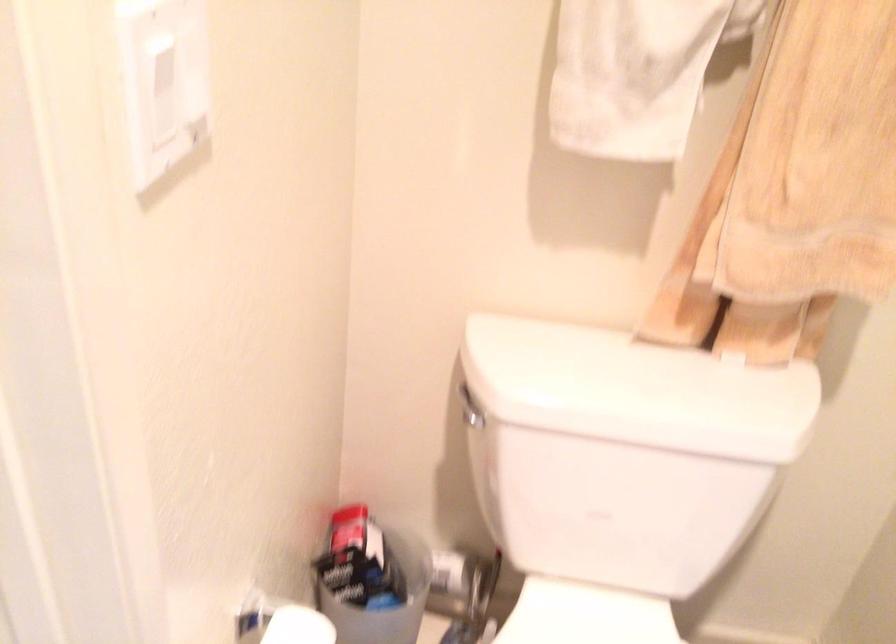
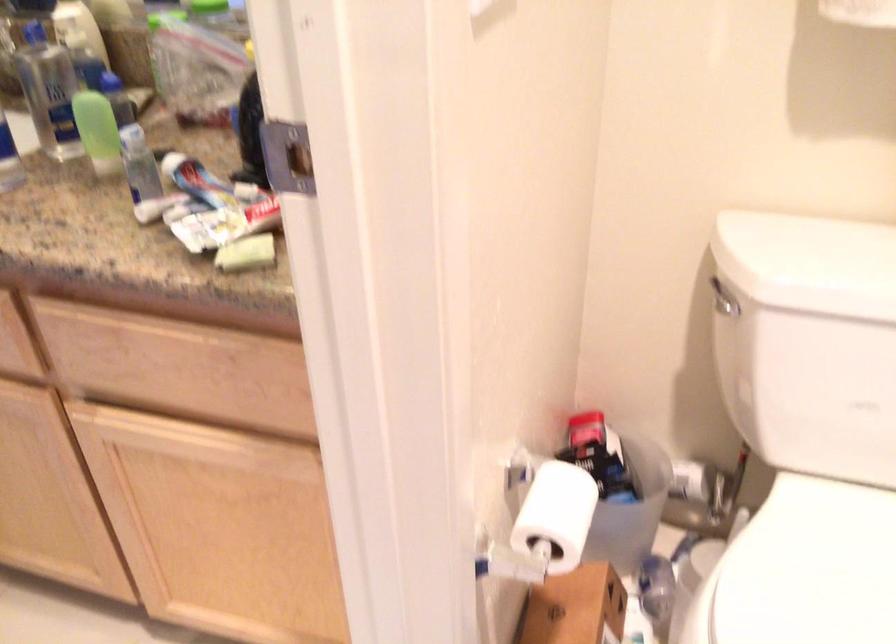
Question: The camera is either moving clockwise (left) or counter-clockwise (right) around the object. The first image is from the beginning of the video and the second image is from the end. Is the camera moving left or right when shooting the video?

Choices:
 (A) Left
 (B) Right

Answer: (B)